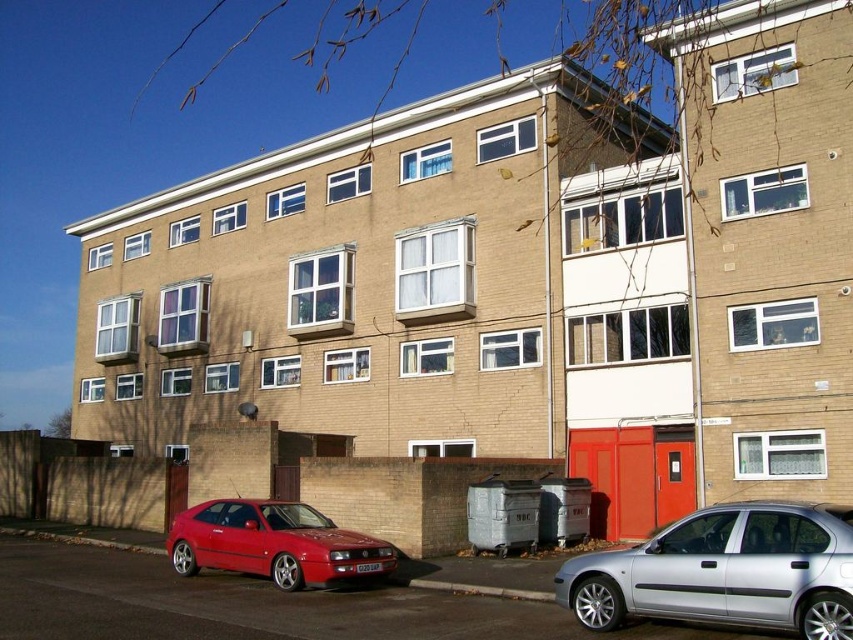
Question: Is silver metallic sedan at lower right positioned in front of glossy red car at lower left?

Choices:
 (A) yes
 (B) no

Answer: (A)

Question: Which of the following is the closest to the observer?

Choices:
 (A) silver metallic sedan at lower right
 (B) glossy red car at lower left

Answer: (A)

Question: Which of the following is the closest to the observer?

Choices:
 (A) glossy red car at lower left
 (B) silver metallic sedan at lower right

Answer: (B)

Question: Does silver metallic sedan at lower right appear on the left side of glossy red car at lower left?

Choices:
 (A) no
 (B) yes

Answer: (A)

Question: Can you confirm if silver metallic sedan at lower right is positioned below glossy red car at lower left?

Choices:
 (A) yes
 (B) no

Answer: (B)